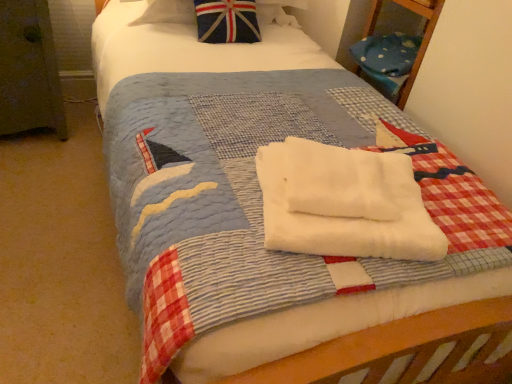
Where is `vacant point above white soft towel at center, the 2th beach towel in the bottom-to-top sequence (from a real-world perspective)`? The height and width of the screenshot is (384, 512). vacant point above white soft towel at center, the 2th beach towel in the bottom-to-top sequence (from a real-world perspective) is located at coordinates (314, 154).